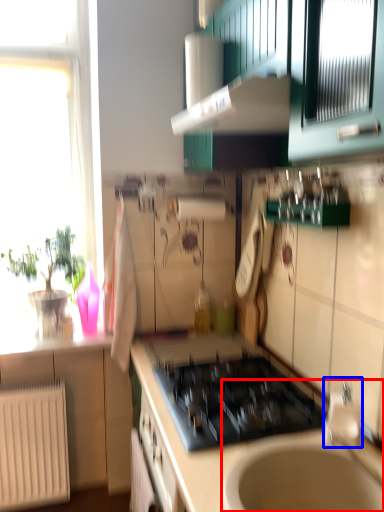
Question: Which object appears farthest to the camera in this image, sink (highlighted by a red box) or faucet (highlighted by a blue box)?

Choices:
 (A) sink
 (B) faucet

Answer: (B)